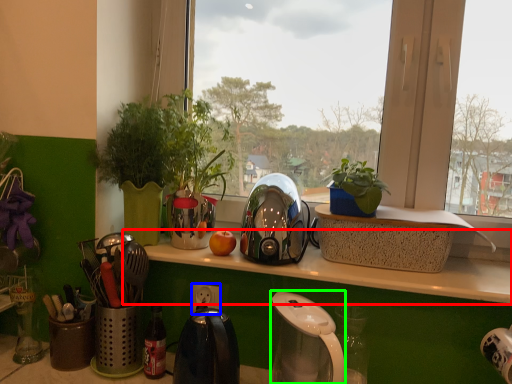
Question: Considering the real-world distances, which object is farthest from window sill (highlighted by a red box)? power outlet (highlighted by a blue box) or coffee maker (highlighted by a green box)?

Choices:
 (A) power outlet
 (B) coffee maker

Answer: (A)